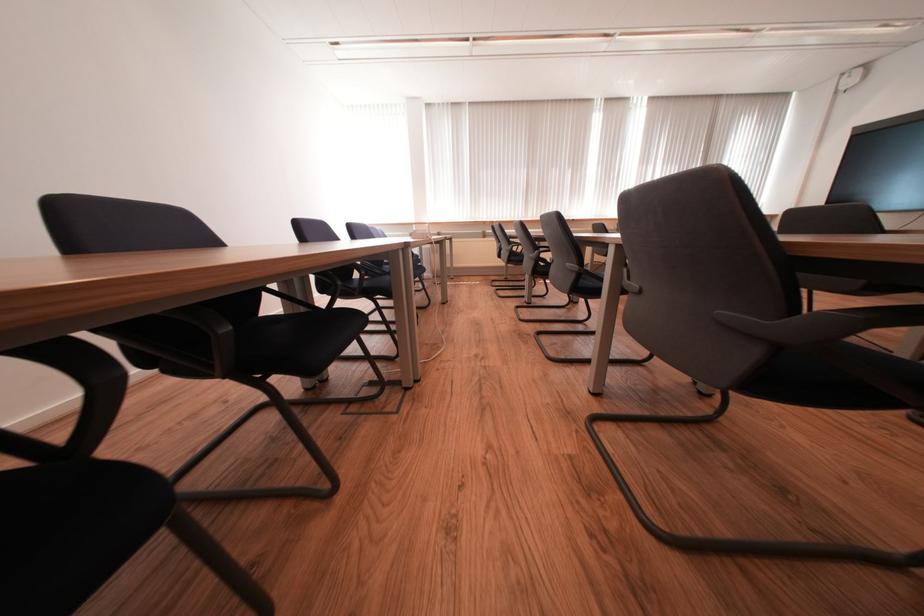
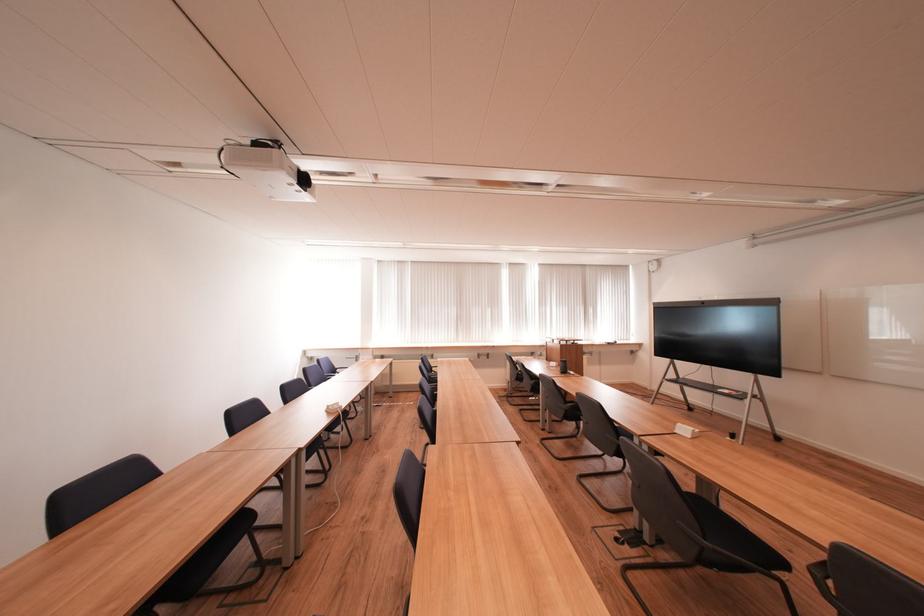
What movement of the cameraman would produce the second image?

The cameraman moved toward right, backward.